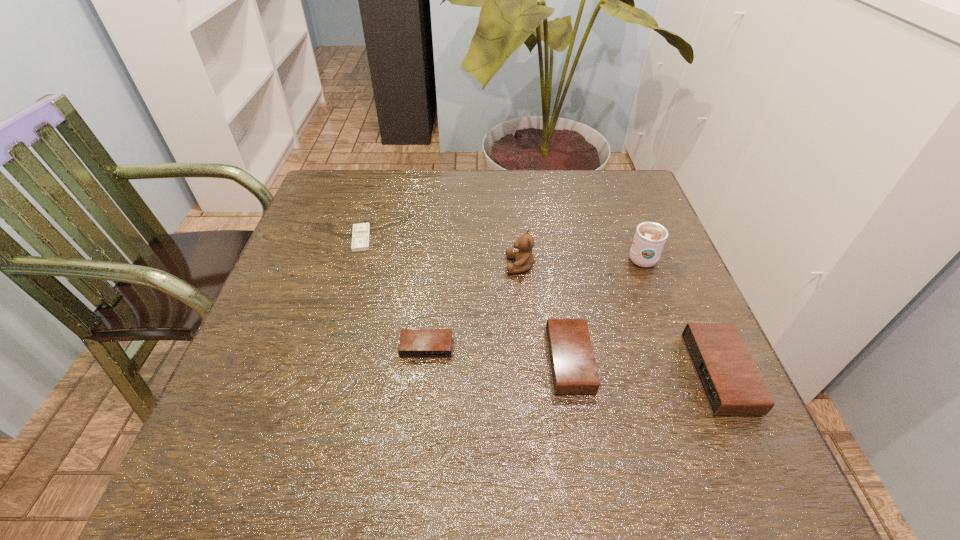
In the current image, all alarm clocks are evenly spaced. To maintain this equal spacing, where should an additional alarm clock be placed on the left? Please point out a free spot. Please provide its 2D coordinates. Your answer should be formatted as a tuple, i.e. [(x, y)], where the tuple contains the x and y coordinates of a point satisfying the conditions above.

[(291, 335)]